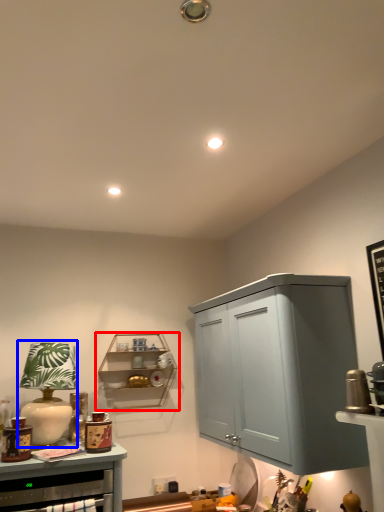
Question: Which object is further to the camera taking this photo, shelf (highlighted by a red box) or table lamp (highlighted by a blue box)?

Choices:
 (A) shelf
 (B) table lamp

Answer: (A)